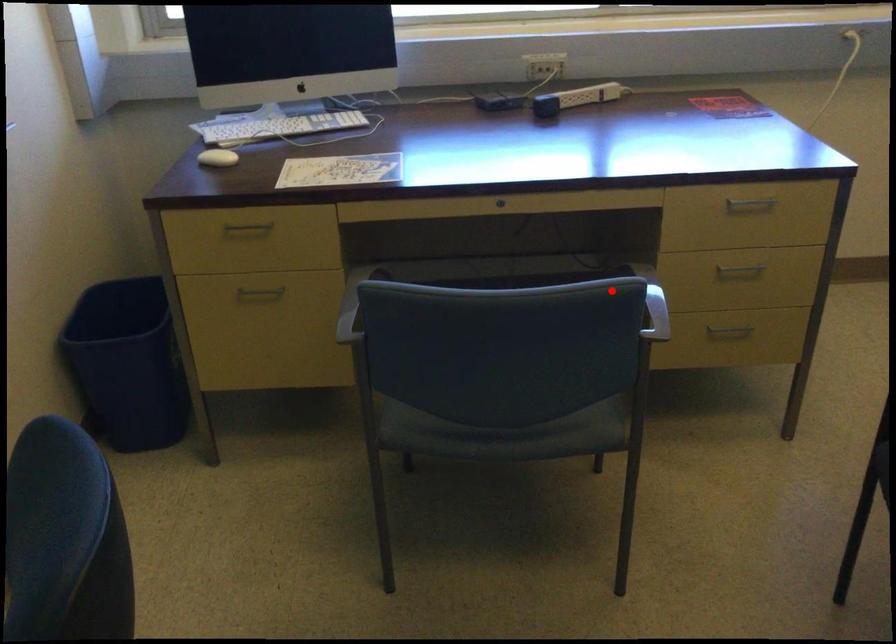
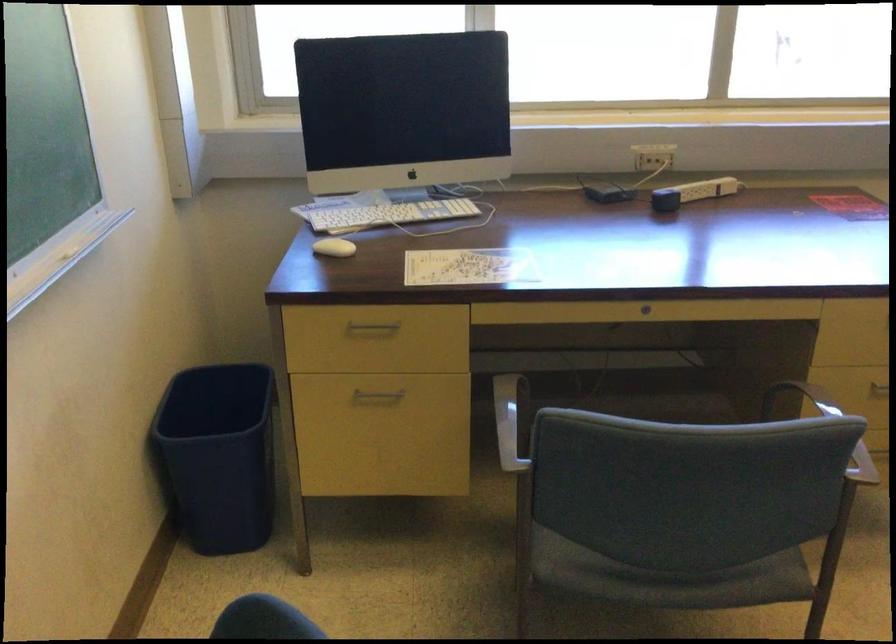
Where in the second image is the point corresponding to the highlighted location from the first image?

(825, 427)